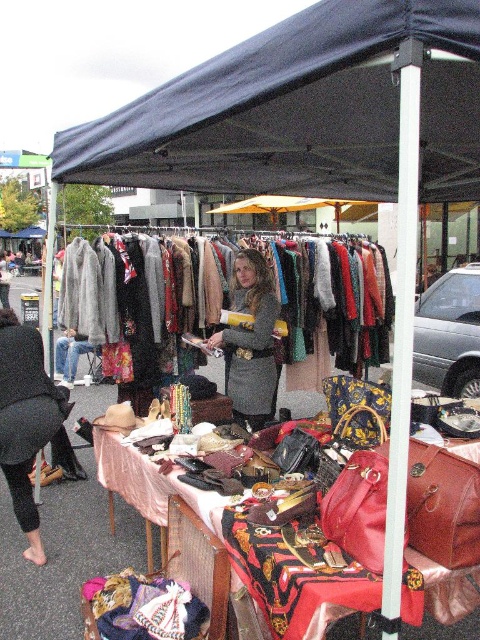
Question: Can you confirm if velvet floral dress at center is wider than gray woolen coat at center?

Choices:
 (A) no
 (B) yes

Answer: (B)

Question: Does dark blue fabric canopy at upper center have a lesser width compared to velvet floral dress at center?

Choices:
 (A) yes
 (B) no

Answer: (B)

Question: Which object is farther from the camera taking this photo?

Choices:
 (A) velvet floral dress at center
 (B) black knit hat at lower left

Answer: (A)

Question: Which object is the farthest from the dark blue fabric canopy at upper center?

Choices:
 (A) gray woolen coat at center
 (B) velvet floral dress at center

Answer: (A)

Question: Is velvet floral dress at center further to the viewer compared to gray woolen coat at center?

Choices:
 (A) yes
 (B) no

Answer: (A)

Question: Estimate the real-world distances between objects in this image. Which object is farther from the dark blue fabric canopy at upper center?

Choices:
 (A) black knit hat at lower left
 (B) velvet floral dress at center
 (C) gray woolen coat at center

Answer: (A)